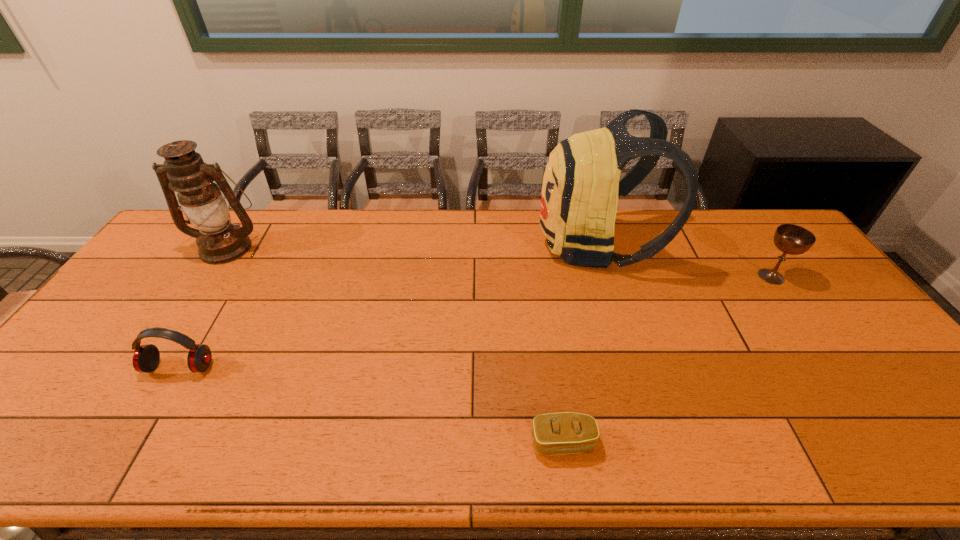
This screenshot has width=960, height=540. Identify the location of free space located 0.110m on the front-facing side of the backpack. (503, 244).

At what (x,y) coordinates should I click in order to perform the action: click on vacant region located 0.050m on the left of the lantern. Please return your answer as a coordinate pair (x, y). This screenshot has height=540, width=960. Looking at the image, I should click on (176, 247).

At what (x,y) coordinates should I click in order to perform the action: click on free space located on the front of the third tallest object. Please return your answer as a coordinate pair (x, y). Looking at the image, I should click on (795, 310).

This screenshot has height=540, width=960. I want to click on blank area located 0.050m on the ear cups of the second shortest object, so click(x=162, y=396).

At what (x,y) coordinates should I click in order to perform the action: click on backpack at the far edge. Please return your answer as a coordinate pair (x, y). Image resolution: width=960 pixels, height=540 pixels. Looking at the image, I should click on (579, 199).

Where is `lantern present at the far edge`? This screenshot has height=540, width=960. lantern present at the far edge is located at coordinates (219, 241).

Where is `object at the near edge`? object at the near edge is located at coordinates (561, 433).

Where is `object positioned at the left edge`? The width and height of the screenshot is (960, 540). object positioned at the left edge is located at coordinates (219, 241).

At what (x,y) coordinates should I click in order to perform the action: click on object that is positioned at the right edge. Please return your answer as a coordinate pair (x, y). The image size is (960, 540). Looking at the image, I should click on (791, 239).

The height and width of the screenshot is (540, 960). In order to click on object that is positioned at the far left corner in this screenshot , I will do `click(219, 241)`.